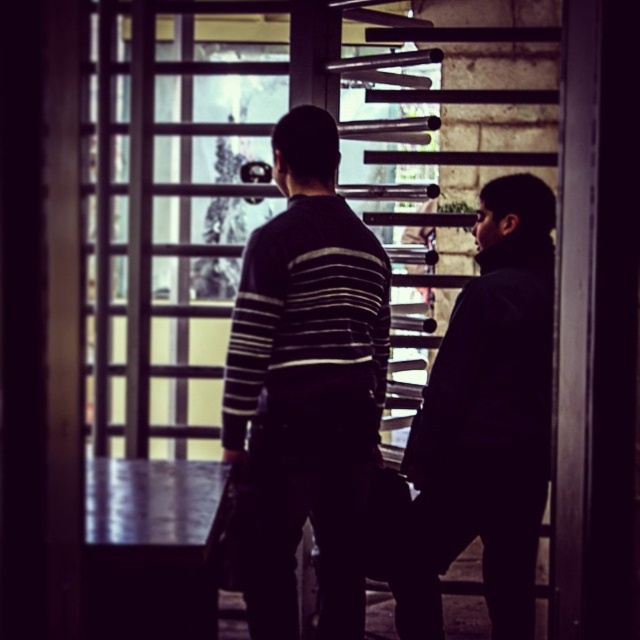
How distant is striped sweater at center from dark matte jacket at right?

22.43 inches

Who is positioned more to the right, striped sweater at center or dark matte jacket at right?

Positioned to the right is dark matte jacket at right.

Does point (248, 412) come behind point (538, 220)?

No.

The height and width of the screenshot is (640, 640). Identify the location of striped sweater at center. tap(307, 385).